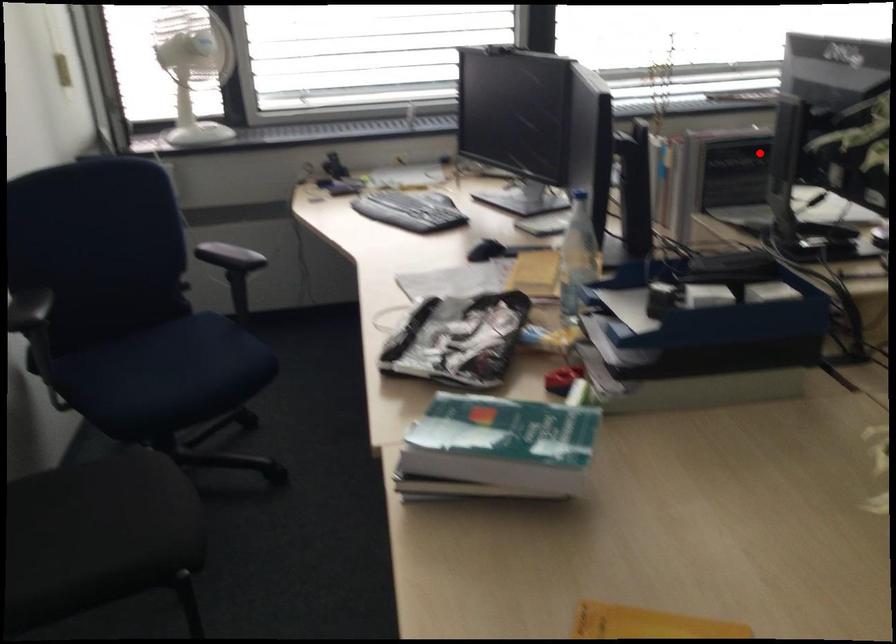
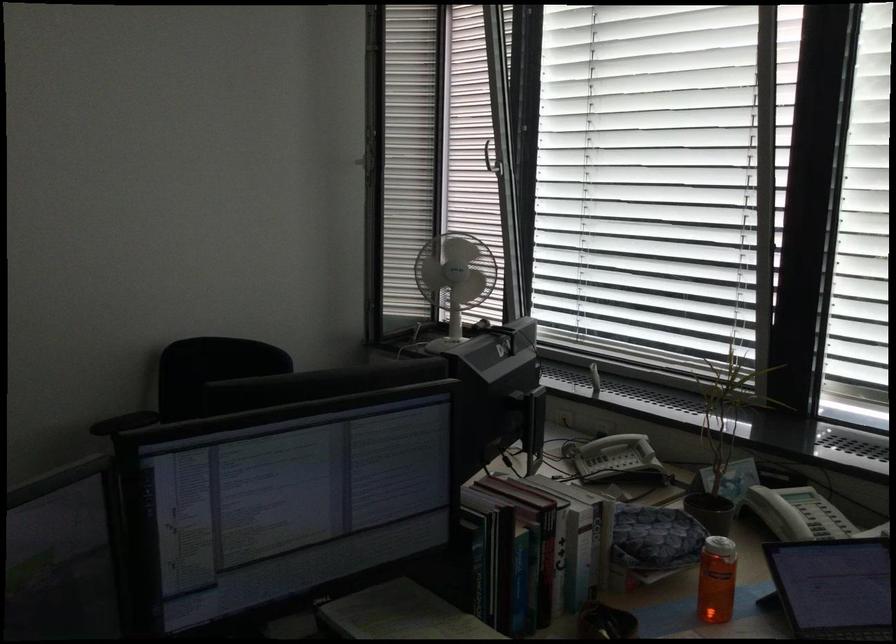
The point at the highlighted location is marked in the first image. Where is the corresponding point in the second image?

(497, 550)